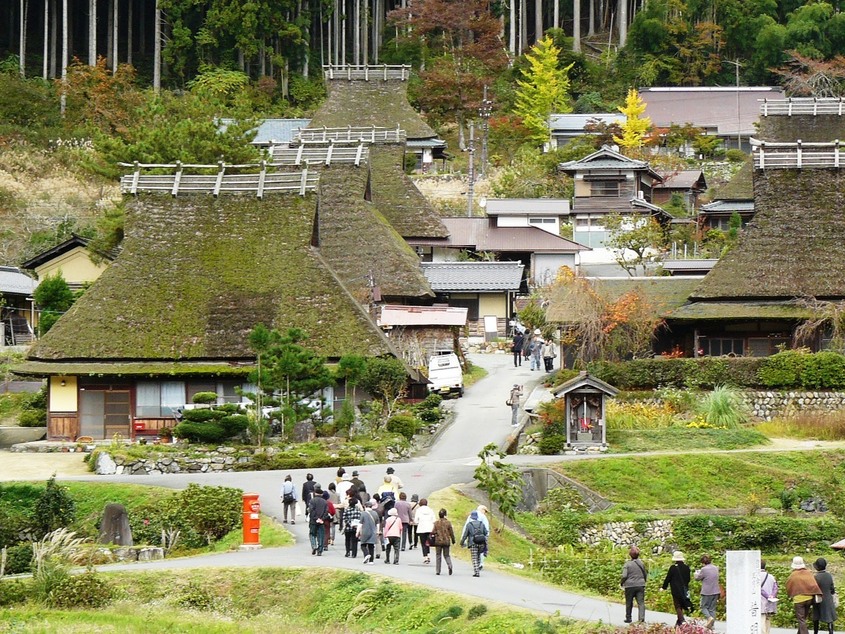
Identify the location of window. (148, 398).